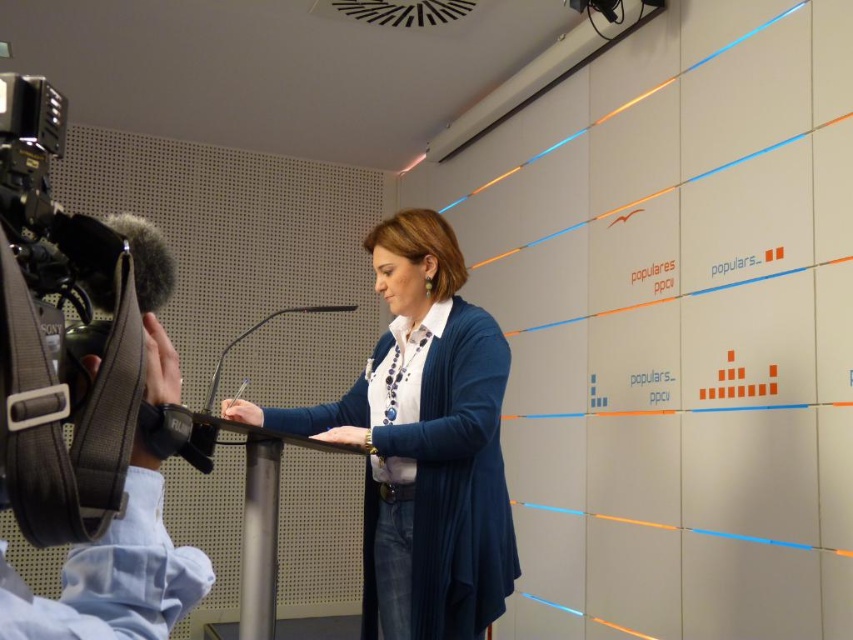
Question: Observing the image, what is the correct spatial positioning of blue fabric at center in reference to black fabric camera at left?

Choices:
 (A) below
 (B) above

Answer: (A)

Question: Can you confirm if blue fabric at center is wider than transparent plastic microphone at center?

Choices:
 (A) yes
 (B) no

Answer: (B)

Question: Which point is farther to the camera?

Choices:
 (A) black fabric camera at left
 (B) transparent plastic microphone at center
 (C) blue fabric at center

Answer: (C)

Question: Which is farther from the transparent plastic microphone at center?

Choices:
 (A) black fabric camera at left
 (B) blue fabric at center

Answer: (A)

Question: Which of the following is the farthest from the observer?

Choices:
 (A) (403, 294)
 (B) (149, 348)

Answer: (A)

Question: Is blue fabric at center positioned in front of transparent plastic microphone at center?

Choices:
 (A) no
 (B) yes

Answer: (A)